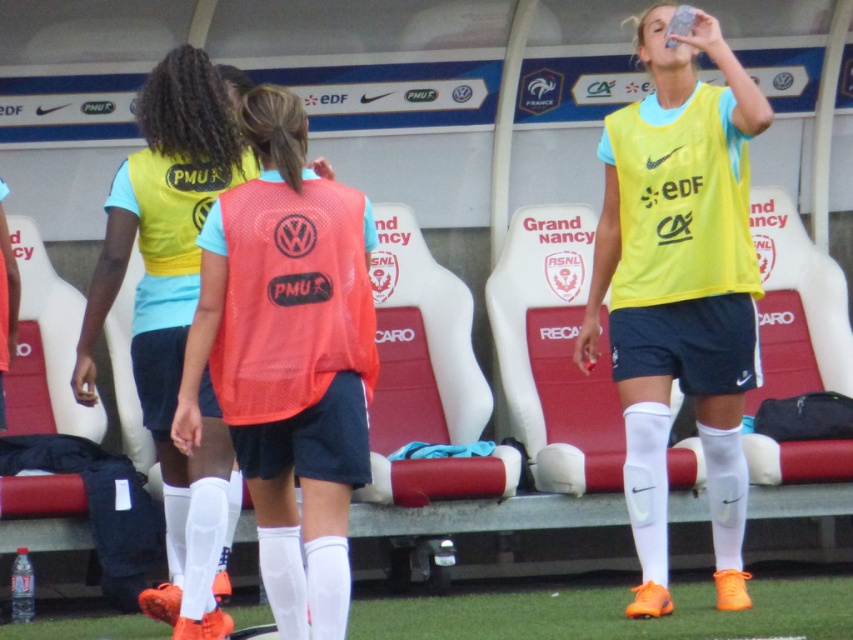
Is matte yellow vest at center behind clear plastic bottle at lower left?

No, it is in front of clear plastic bottle at lower left.

Image resolution: width=853 pixels, height=640 pixels. I want to click on matte yellow vest at center, so [x=173, y=307].

Is yellow matte jersey at center positioned before clear plastic bottle at lower left?

Yes, it is in front of clear plastic bottle at lower left.

In the scene shown: Which is more to the left, yellow matte jersey at center or clear plastic bottle at lower left?

Positioned to the left is clear plastic bottle at lower left.

Identify the location of yellow matte jersey at center. (679, 288).

Does yellow matte jersey at center have a greater height compared to matte yellow vest at center?

Correct, yellow matte jersey at center is much taller as matte yellow vest at center.

Between point (741, 188) and point (198, 396), which one is positioned behind?

The point (741, 188) is behind.

Where is `yellow matte jersey at center`? Image resolution: width=853 pixels, height=640 pixels. yellow matte jersey at center is located at coordinates (679, 288).